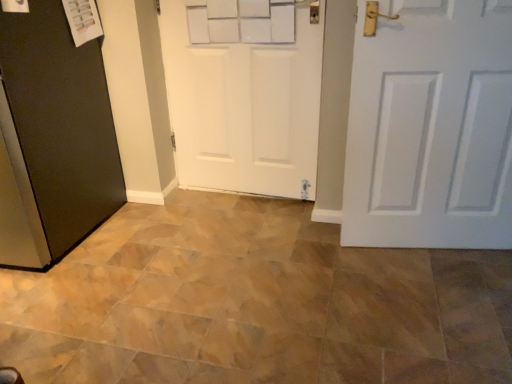
What do you see at coordinates (53, 137) in the screenshot? I see `black matte door at left, placed as the first door when sorted from left to right` at bounding box center [53, 137].

What is the approximate width of black matte door at left, which appears as the 3th door when viewed from the right?

black matte door at left, which appears as the 3th door when viewed from the right, is 29.98 inches in width.

What do you see at coordinates (244, 93) in the screenshot?
I see `white matte door at center, the 2th door positioned from the right` at bounding box center [244, 93].

The height and width of the screenshot is (384, 512). What do you see at coordinates (430, 126) in the screenshot? I see `white matte door at center, which is the 3th door from left to right` at bounding box center [430, 126].

In order to face brown ceramic tile at center, should I rotate leftwards or rightwards?

Turn left by 0.425 degrees to look at brown ceramic tile at center.

Identify the location of black matte door at left, placed as the first door when sorted from left to right. This screenshot has width=512, height=384. (53, 137).

Which door is the 2nd one when counting from the back of the brown ceramic tile at center? Please provide its 2D coordinates.

[(430, 126)]

Are brown ceramic tile at center and white matte door at center, which is the 3th door from left to right, making contact?

There is a gap between brown ceramic tile at center and white matte door at center, which is the 3th door from left to right.

Between brown ceramic tile at center and white matte door at center, the first door positioned from the right, which one has larger size?

brown ceramic tile at center is bigger.

From the picture: Which is in front, brown ceramic tile at center or black matte door at left, which appears as the 3th door when viewed from the right?

brown ceramic tile at center is in front.

Considering the sizes of objects brown ceramic tile at center and black matte door at left, which appears as the 3th door when viewed from the right, in the image provided, who is wider, brown ceramic tile at center or black matte door at left, which appears as the 3th door when viewed from the right,?

With larger width is brown ceramic tile at center.

Where is `ceramic tile that is below the black matte door at left, placed as the first door when sorted from left to right (from the image's perspective)`? The height and width of the screenshot is (384, 512). ceramic tile that is below the black matte door at left, placed as the first door when sorted from left to right (from the image's perspective) is located at coordinates (254, 303).

Between brown ceramic tile at center and black matte door at left, which appears as the 3th door when viewed from the right, which one has smaller size?

Smaller between the two is brown ceramic tile at center.

From a real-world perspective, between black matte door at left, which appears as the 3th door when viewed from the right, and white matte door at center, the 2th door positioned from the right, who is vertically lower?

black matte door at left, which appears as the 3th door when viewed from the right, is physically lower.

Considering the relative sizes of black matte door at left, placed as the first door when sorted from left to right, and white matte door at center, the 2th door positioned from the right, in the image provided, is black matte door at left, placed as the first door when sorted from left to right, smaller than white matte door at center, the 2th door positioned from the right,?

Actually, black matte door at left, placed as the first door when sorted from left to right, might be larger than white matte door at center, the 2th door positioned from the right.

Between black matte door at left, placed as the first door when sorted from left to right, and white matte door at center, positioned as the second door in left-to-right order, which one appears on the left side from the viewer's perspective?

Positioned to the left is black matte door at left, placed as the first door when sorted from left to right.

Is black matte door at left, placed as the first door when sorted from left to right, oriented away from white matte door at center, positioned as the second door in left-to-right order?

That's not correct — black matte door at left, placed as the first door when sorted from left to right, is not looking away from white matte door at center, positioned as the second door in left-to-right order.

Is brown ceramic tile at center surrounded by black matte door at left, which appears as the 3th door when viewed from the right?

That's incorrect, brown ceramic tile at center is not inside black matte door at left, which appears as the 3th door when viewed from the right.

How distant is black matte door at left, placed as the first door when sorted from left to right, from brown ceramic tile at center?

black matte door at left, placed as the first door when sorted from left to right, and brown ceramic tile at center are 28.03 inches apart.

At what (x,y) coordinates should I click in order to perform the action: click on the 2nd door to the left of the brown ceramic tile at center, counting from the anchor's position. Please return your answer as a coordinate pair (x, y). The image size is (512, 384). Looking at the image, I should click on (53, 137).

Considering the relative sizes of black matte door at left, placed as the first door when sorted from left to right, and brown ceramic tile at center in the image provided, is black matte door at left, placed as the first door when sorted from left to right, taller than brown ceramic tile at center?

Correct, black matte door at left, placed as the first door when sorted from left to right, is much taller as brown ceramic tile at center.

In the image, is white matte door at center, which is the 3th door from left to right, positioned in front of or behind white matte door at center, positioned as the second door in left-to-right order?

Visually, white matte door at center, which is the 3th door from left to right, is located in front of white matte door at center, positioned as the second door in left-to-right order.

Can you tell me how much white matte door at center, the first door positioned from the right, and white matte door at center, the 2th door positioned from the right, differ in facing direction?

white matte door at center, the first door positioned from the right, and white matte door at center, the 2th door positioned from the right, are facing 14.6 degrees away from each other.

Which object is positioned more to the left, white matte door at center, the first door positioned from the right, or white matte door at center, positioned as the second door in left-to-right order?

Positioned to the left is white matte door at center, positioned as the second door in left-to-right order.

From a real-world perspective, is white matte door at center, which is the 3th door from left to right, positioned above or below white matte door at center, the 2th door positioned from the right?

white matte door at center, which is the 3th door from left to right, is below white matte door at center, the 2th door positioned from the right.

Where is `ceramic tile that is in front of the white matte door at center, positioned as the second door in left-to-right order`? ceramic tile that is in front of the white matte door at center, positioned as the second door in left-to-right order is located at coordinates (254, 303).

From a real-world perspective, is brown ceramic tile at center physically located above or below white matte door at center, the 2th door positioned from the right?

From a real-world perspective, brown ceramic tile at center is physically below white matte door at center, the 2th door positioned from the right.

Does brown ceramic tile at center come in front of white matte door at center, the 2th door positioned from the right?

Yes, the depth of brown ceramic tile at center is less than that of white matte door at center, the 2th door positioned from the right.

Is white matte door at center, the 2th door positioned from the right, not near black matte door at left, placed as the first door when sorted from left to right?

white matte door at center, the 2th door positioned from the right, is near black matte door at left, placed as the first door when sorted from left to right, not far away.

Could you tell me if white matte door at center, the 2th door positioned from the right, is facing black matte door at left, which appears as the 3th door when viewed from the right?

No, white matte door at center, the 2th door positioned from the right, is not aimed at black matte door at left, which appears as the 3th door when viewed from the right.

From the image's perspective, is white matte door at center, the 2th door positioned from the right, over black matte door at left, placed as the first door when sorted from left to right?

Yes.

Which of these two, white matte door at center, the 2th door positioned from the right, or black matte door at left, placed as the first door when sorted from left to right, is wider?

black matte door at left, placed as the first door when sorted from left to right, is wider.

Identify the location of door lying on the right of brown ceramic tile at center. (430, 126).

From a real-world perspective, which door is the 2nd one above the brown ceramic tile at center? Please provide its 2D coordinates.

[(53, 137)]

Based on their spatial positions, is black matte door at left, placed as the first door when sorted from left to right, or white matte door at center, which is the 3th door from left to right, closer to white matte door at center, the 2th door positioned from the right?

The object closer to white matte door at center, the 2th door positioned from the right, is white matte door at center, which is the 3th door from left to right.

From the image, which object appears to be nearer to white matte door at center, positioned as the second door in left-to-right order, brown ceramic tile at center or black matte door at left, which appears as the 3th door when viewed from the right?

Among the two, black matte door at left, which appears as the 3th door when viewed from the right, is located nearer to white matte door at center, positioned as the second door in left-to-right order.

Considering their positions, is black matte door at left, which appears as the 3th door when viewed from the right, positioned closer to white matte door at center, which is the 3th door from left to right, than white matte door at center, the 2th door positioned from the right?

The object closer to white matte door at center, which is the 3th door from left to right, is white matte door at center, the 2th door positioned from the right.

Which object lies nearer to the anchor point black matte door at left, placed as the first door when sorted from left to right, white matte door at center, positioned as the second door in left-to-right order, or brown ceramic tile at center?

Among the two, white matte door at center, positioned as the second door in left-to-right order, is located nearer to black matte door at left, placed as the first door when sorted from left to right.

Looking at the image, which one is located further to white matte door at center, the first door positioned from the right, brown ceramic tile at center or black matte door at left, which appears as the 3th door when viewed from the right?

The object further to white matte door at center, the first door positioned from the right, is black matte door at left, which appears as the 3th door when viewed from the right.

Which object lies further to the anchor point black matte door at left, which appears as the 3th door when viewed from the right, white matte door at center, the first door positioned from the right, or brown ceramic tile at center?

white matte door at center, the first door positioned from the right, lies further to black matte door at left, which appears as the 3th door when viewed from the right, than the other object.

Which object lies nearer to the anchor point brown ceramic tile at center, black matte door at left, placed as the first door when sorted from left to right, or white matte door at center, which is the 3th door from left to right?

white matte door at center, which is the 3th door from left to right, lies closer to brown ceramic tile at center than the other object.

Looking at the image, which one is located further to black matte door at left, which appears as the 3th door when viewed from the right, white matte door at center, the first door positioned from the right, or white matte door at center, positioned as the second door in left-to-right order?

white matte door at center, the first door positioned from the right, is positioned further to the anchor black matte door at left, which appears as the 3th door when viewed from the right.

Image resolution: width=512 pixels, height=384 pixels. What are the coordinates of `ceramic tile situated between black matte door at left, placed as the first door when sorted from left to right, and white matte door at center, the first door positioned from the right, from left to right` in the screenshot? It's located at (254, 303).

Locate an element on the screen. The width and height of the screenshot is (512, 384). door between black matte door at left, which appears as the 3th door when viewed from the right, and white matte door at center, the first door positioned from the right, in the horizontal direction is located at coordinates (244, 93).

Where is `door situated between black matte door at left, placed as the first door when sorted from left to right, and brown ceramic tile at center from left to right`? The width and height of the screenshot is (512, 384). door situated between black matte door at left, placed as the first door when sorted from left to right, and brown ceramic tile at center from left to right is located at coordinates (244, 93).